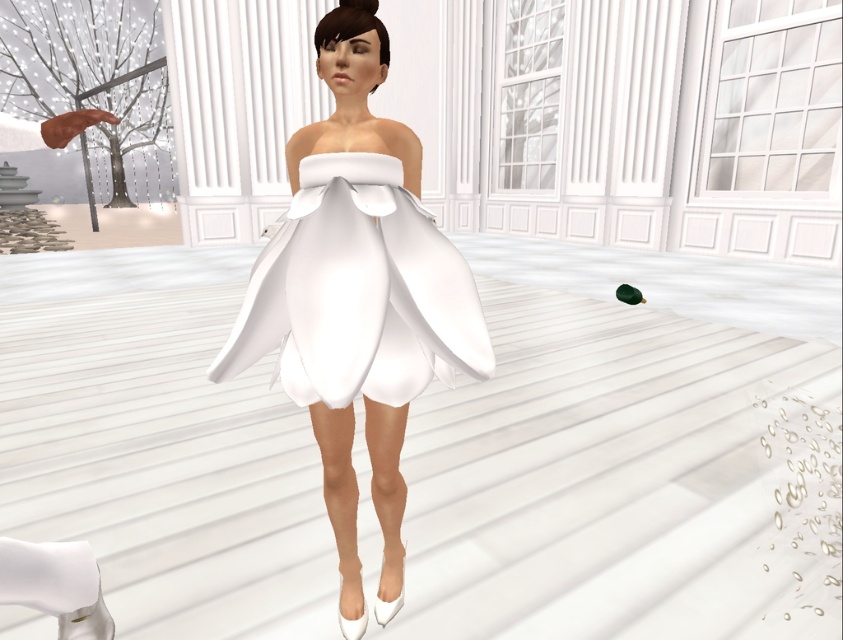
You are a game developer working on a virtual world. You need to place a new NPC at a specific coordinate to interact with the white satin dress at center. The coordinate given is point (358,298). Is this coordinate correct for placing the NPC near the white satin dress at center?

Yes, the coordinate point (358,298) corresponds to the white satin dress at center, so placing the NPC there will position it near the dress.

You are a game character standing in the middle of the room. You see two dresses in front of you, the white satin dress at center and the satin white dress at center. Which dress is positioned to the right side?

The white satin dress at center is positioned to the right of the satin white dress at center.

Based on the coordinates provided, where exactly is the white satin dress at center located?

The white satin dress at center is located at point coordinates of (358, 298).